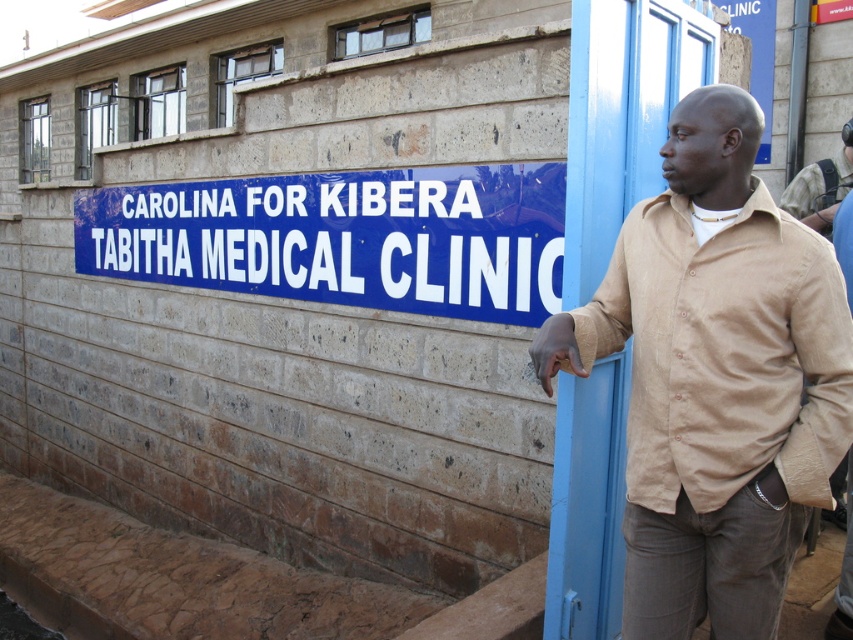
You are a photographer trying to capture the clinic entrance. You notice two beige cotton shirts in the scene. Which one is taller? The beige cotton shirt at center or the beige cotton shirt at upper right?

The beige cotton shirt at center is taller than the beige cotton shirt at upper right.

You are a photographer trying to capture the man in the beige cotton shirt at center while ensuring the clinic sign is visible in the background. Based on the coordinates provided, where should you position yourself relative to the shirt?

The beige cotton shirt at center is located at point (715, 380), so positioning yourself slightly to the right and above the shirt would ensure the clinic sign in the background is visible.